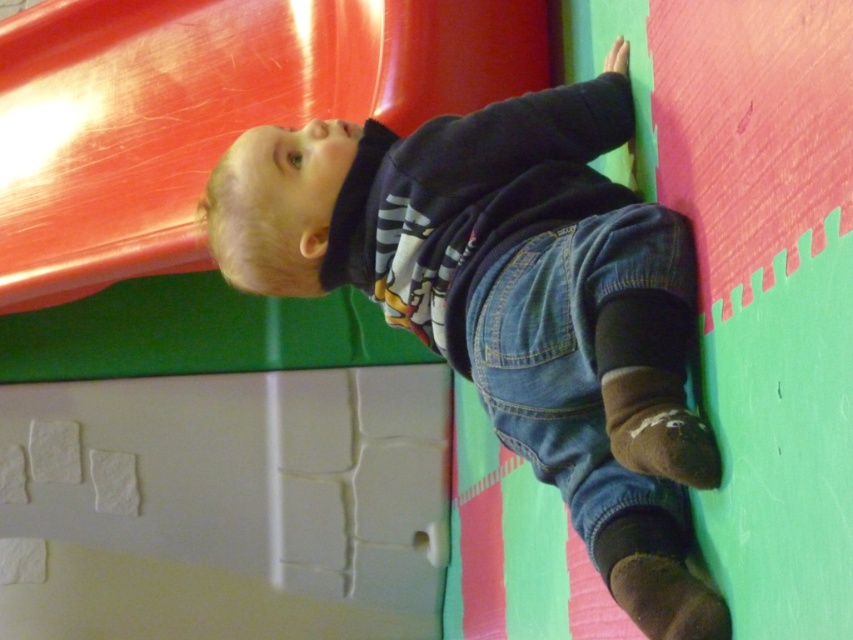
Question: Which point is farther from the camera taking this photo?

Choices:
 (A) (686, 264)
 (B) (448, 67)

Answer: (B)

Question: Can you confirm if denim overalls at center is positioned to the left of denim at lower right?

Choices:
 (A) no
 (B) yes

Answer: (B)

Question: Among these objects, which one is nearest to the camera?

Choices:
 (A) shiny plastic slide at upper left
 (B) denim overalls at center
 (C) denim at lower right

Answer: (B)

Question: Among these points, which one is nearest to the camera?

Choices:
 (A) (90, 138)
 (B) (627, 388)
 (C) (503, 412)

Answer: (B)

Question: Does shiny plastic slide at upper left come in front of denim at lower right?

Choices:
 (A) yes
 (B) no

Answer: (B)

Question: Is denim overalls at center bigger than shiny plastic slide at upper left?

Choices:
 (A) no
 (B) yes

Answer: (A)